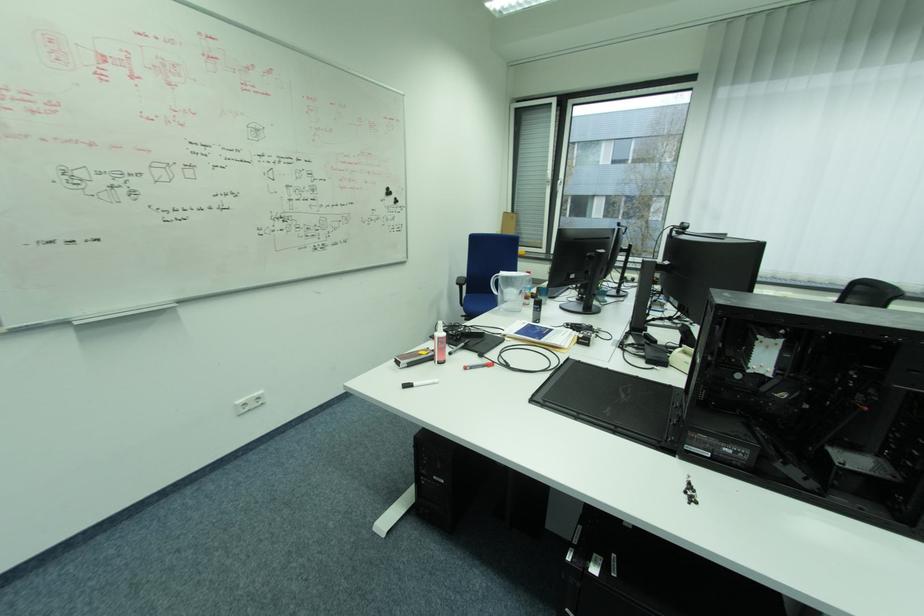
The location [440,342] corresponds to which object?

It refers to a white tube bottle.